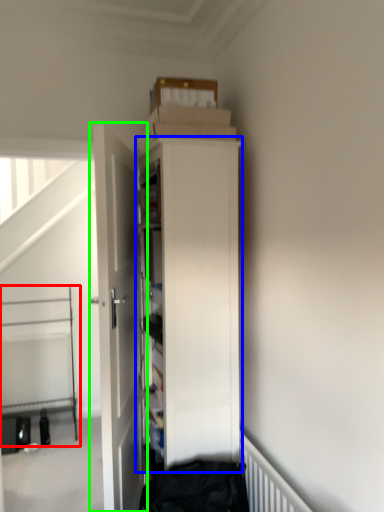
Question: Which object is the closest to the bed (highlighted by a red box)? Choose among these: cabinetry (highlighted by a blue box) or door (highlighted by a green box).

Choices:
 (A) cabinetry
 (B) door

Answer: (B)